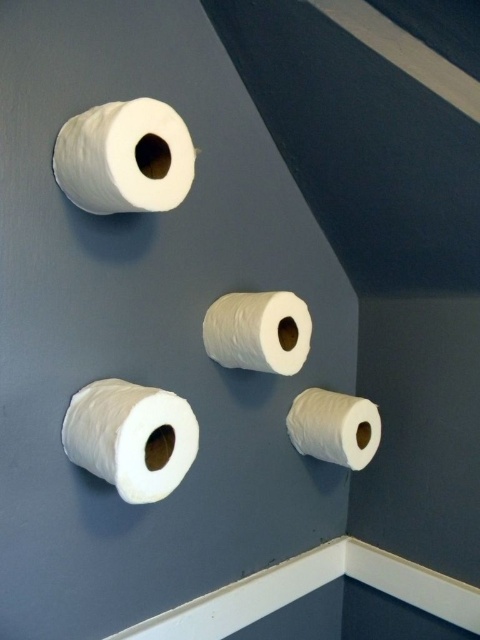
Is white matte paper towel at upper left bigger than white matte paper towel at center?

Yes.

Which is behind, point (148, 166) or point (290, 314)?

The point (290, 314) is more distant.

Between point (180, 120) and point (265, 369), which one is positioned behind?

The point (265, 369) is more distant.

Find the location of a particular element. This screenshot has width=480, height=640. white matte paper towel at upper left is located at coordinates click(x=124, y=157).

Is point (131, 484) farther from viewer compared to point (316, 435)?

No, (131, 484) is closer to viewer.

Who is shorter, white matte toilet paper at lower left or white matte toilet paper at lower right?

Standing shorter between the two is white matte toilet paper at lower right.

Where is `white matte toilet paper at lower left`? The height and width of the screenshot is (640, 480). white matte toilet paper at lower left is located at coordinates (132, 436).

Which of these two, white matte toilet paper at lower left or white matte paper towel at center, stands taller?

white matte toilet paper at lower left is taller.

Is white matte toilet paper at lower left shorter than white matte paper towel at center?

No, white matte toilet paper at lower left is not shorter than white matte paper towel at center.

The height and width of the screenshot is (640, 480). Identify the location of white matte toilet paper at lower left. point(132,436).